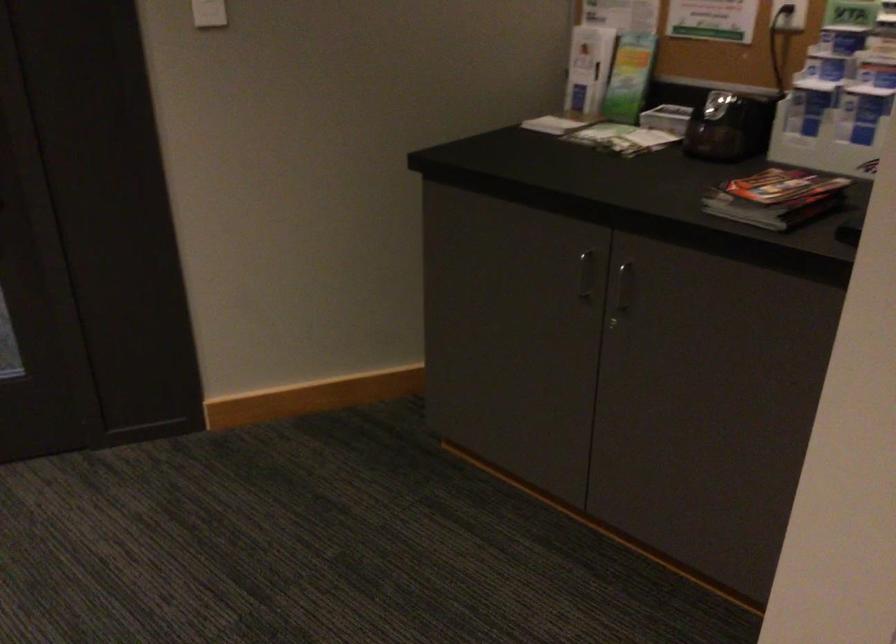
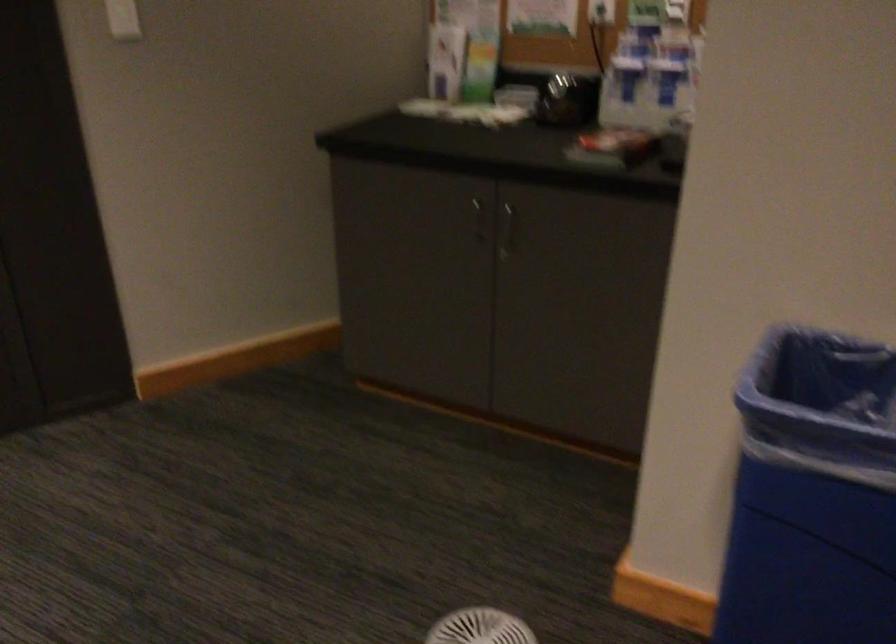
In the scene shown: In a continuous first-person perspective shot, in which direction is the camera moving?

The cameraman walked toward left, backward.